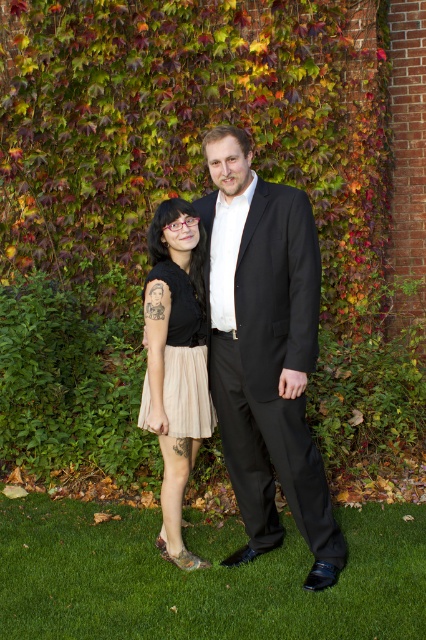
This screenshot has height=640, width=426. What do you see at coordinates (201, 577) in the screenshot?
I see `green grass at lower center` at bounding box center [201, 577].

Is green grass at lower center smaller than beige pleated skirt at lower left?

No.

Is point (22, 602) more distant than point (181, 282)?

That is False.

The image size is (426, 640). In order to click on green grass at lower center in this screenshot , I will do `click(201, 577)`.

Is green grass at lower center further to the viewer compared to matte black dress at center?

No, green grass at lower center is closer to the viewer.

Between green grass at lower center and matte black dress at center, which one has less height?

green grass at lower center

Does point (242, 616) lie behind point (204, 435)?

No, (242, 616) is in front of (204, 435).

At what (x,y) coordinates should I click in order to perform the action: click on green grass at lower center. Please return your answer as a coordinate pair (x, y). The height and width of the screenshot is (640, 426). Looking at the image, I should click on (201, 577).

Can you confirm if black smooth suit at center is taller than beige pleated skirt at lower left?

Correct, black smooth suit at center is much taller as beige pleated skirt at lower left.

Does point (307, 428) come in front of point (187, 374)?

Yes, point (307, 428) is closer to viewer.

Which is in front, point (294, 496) or point (184, 323)?

Point (294, 496)

The width and height of the screenshot is (426, 640). In order to click on black smooth suit at center in this screenshot , I will do `click(264, 352)`.